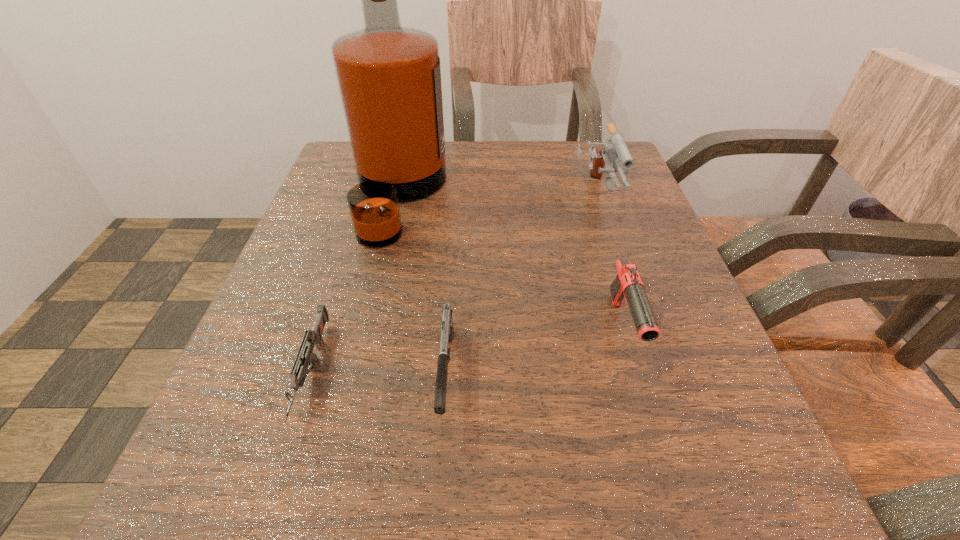
Image resolution: width=960 pixels, height=540 pixels. I want to click on liquor, so click(x=389, y=78).

Find the location of a particular element. The height and width of the screenshot is (540, 960). the fourth shortest object is located at coordinates (614, 150).

Identify the location of the farthest gun. (614, 150).

Identify the location of the third shortest object. (628, 283).

Where is `the second shortest gun`? The width and height of the screenshot is (960, 540). the second shortest gun is located at coordinates (447, 330).

You are a GUI agent. You are given a task and a screenshot of the screen. Output one action in this format:
    pyautogui.click(x=<x>, y=<y>)
    Task: Click on the second shortest object
    This screenshot has width=960, height=540.
    Given the screenshot: What is the action you would take?
    coord(447,330)

Find the location of a particular element. The image size is (960, 540). the leftmost gun is located at coordinates (313, 337).

Identify the location of the shortest object. (313, 337).

Locate an element on the screen. Image resolution: width=960 pixels, height=540 pixels. vacant space located 0.390m on the front label of the liquor is located at coordinates (637, 197).

Locate an element on the screen. This screenshot has height=540, width=960. vacant space situated at the barrel end of the fourth shortest object is located at coordinates (653, 368).